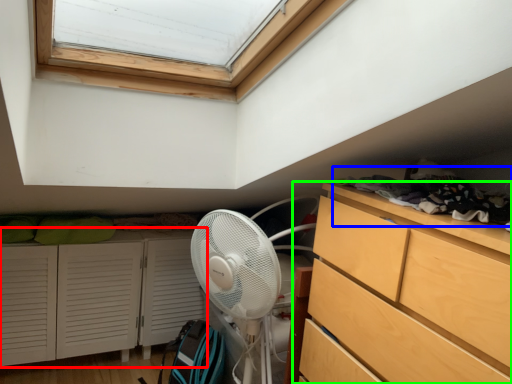
Question: Based on their relative distances, which object is farther from cupboard (highlighted by a red box)? Choose from laundry (highlighted by a blue box) and chest of drawers (highlighted by a green box).

Choices:
 (A) laundry
 (B) chest of drawers

Answer: (A)